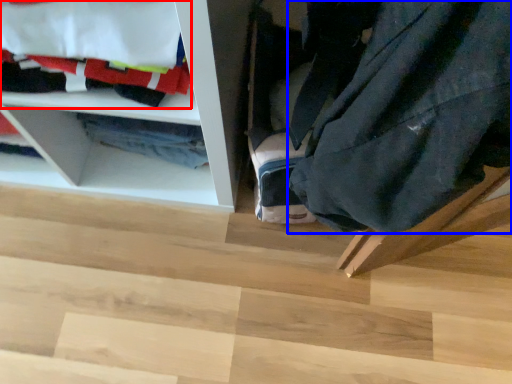
Question: Which point is further to the camera, laundry (highlighted by a red box) or clothing (highlighted by a blue box)?

Choices:
 (A) laundry
 (B) clothing

Answer: (A)